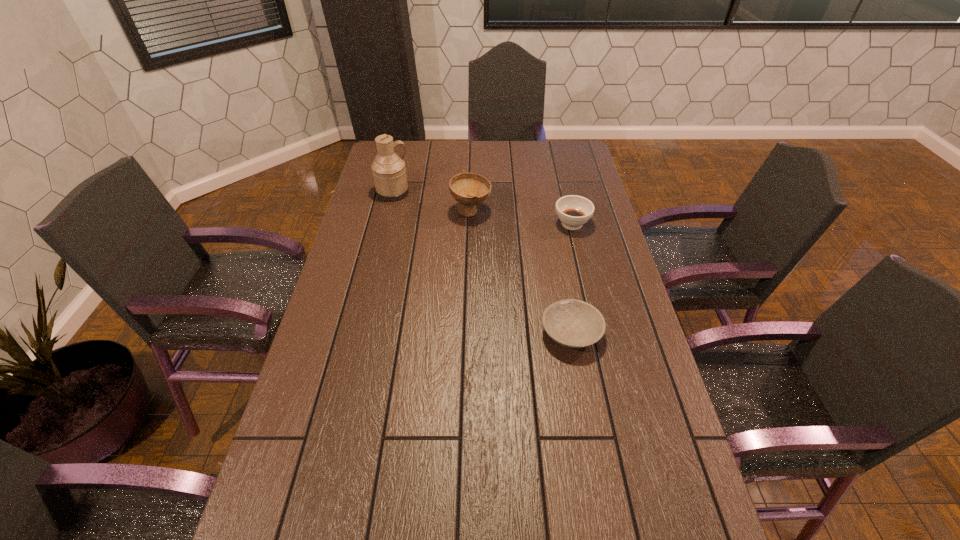
What are the coordinates of `vacant space situated 0.100m on the left of the shorter soup bowl` in the screenshot? It's located at (525, 224).

Identify the location of blank space located on the back of the nearest object. Image resolution: width=960 pixels, height=540 pixels. (559, 267).

You are a GUI agent. You are given a task and a screenshot of the screen. Output one action in this format:
    pyautogui.click(x=<x>, y=<y>)
    Task: Click on the object that is at the left edge
    This screenshot has height=540, width=960.
    Given the screenshot: What is the action you would take?
    pyautogui.click(x=389, y=171)

Image resolution: width=960 pixels, height=540 pixels. I want to click on soup bowl situated at the right edge, so click(x=573, y=211).

Identify the location of bowl positioned at the right edge. (572, 323).

Locate an element on the screen. This screenshot has width=960, height=540. free space at the far edge of the desktop is located at coordinates (418, 166).

The height and width of the screenshot is (540, 960). Find the location of `free space at the left edge of the desktop`. free space at the left edge of the desktop is located at coordinates (340, 338).

Locate an element on the screen. This screenshot has height=540, width=960. free space at the right edge of the desktop is located at coordinates (575, 272).

Where is `vacant space at the far right corner of the desktop`? The width and height of the screenshot is (960, 540). vacant space at the far right corner of the desktop is located at coordinates (574, 167).

The width and height of the screenshot is (960, 540). Find the location of `unoccupied position between the shorter soup bowl and the leftmost object`. unoccupied position between the shorter soup bowl and the leftmost object is located at coordinates (483, 208).